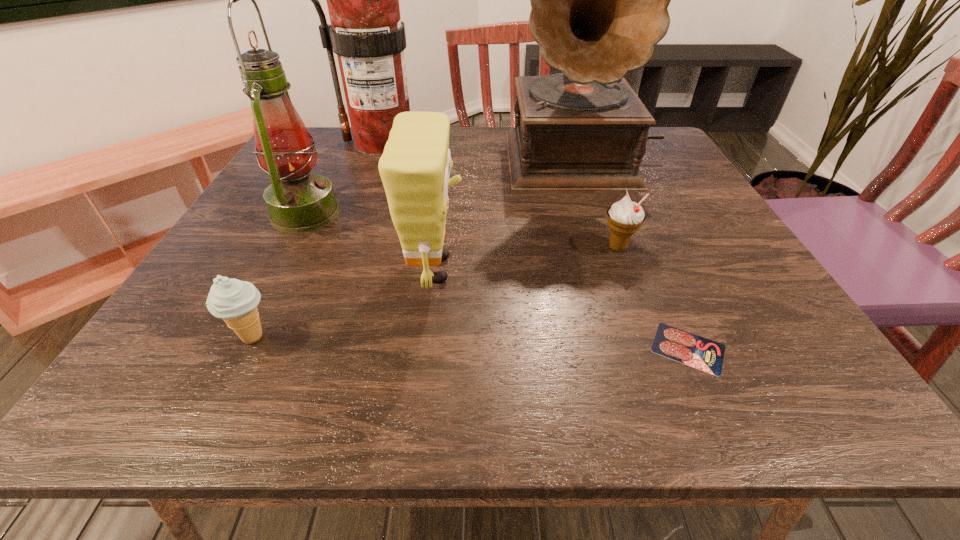
This screenshot has height=540, width=960. I want to click on free space located 0.280m on the face of the fourth tallest object, so click(620, 270).

Where is `free spot located on the front of the farther icecream`? free spot located on the front of the farther icecream is located at coordinates (637, 301).

Image resolution: width=960 pixels, height=540 pixels. In order to click on vacant space located 0.110m on the left of the left icecream in this screenshot , I will do `click(157, 337)`.

Identify the location of vacant space located 0.290m on the left of the salami. Image resolution: width=960 pixels, height=540 pixels. (457, 348).

At what (x,y) coordinates should I click in order to perform the action: click on fire extinguisher at the far edge. Please return your answer as a coordinate pair (x, y). The height and width of the screenshot is (540, 960). Looking at the image, I should click on (366, 32).

This screenshot has height=540, width=960. Identify the location of record player positioned at the far edge. (599, 0).

I want to click on object that is at the near edge, so click(701, 353).

The image size is (960, 540). Find the location of `fire extinguisher that is at the left edge`. fire extinguisher that is at the left edge is located at coordinates (366, 32).

I want to click on oil lamp present at the left edge, so click(x=298, y=201).

Identify the location of icecream that is at the left edge. The width and height of the screenshot is (960, 540). (235, 301).